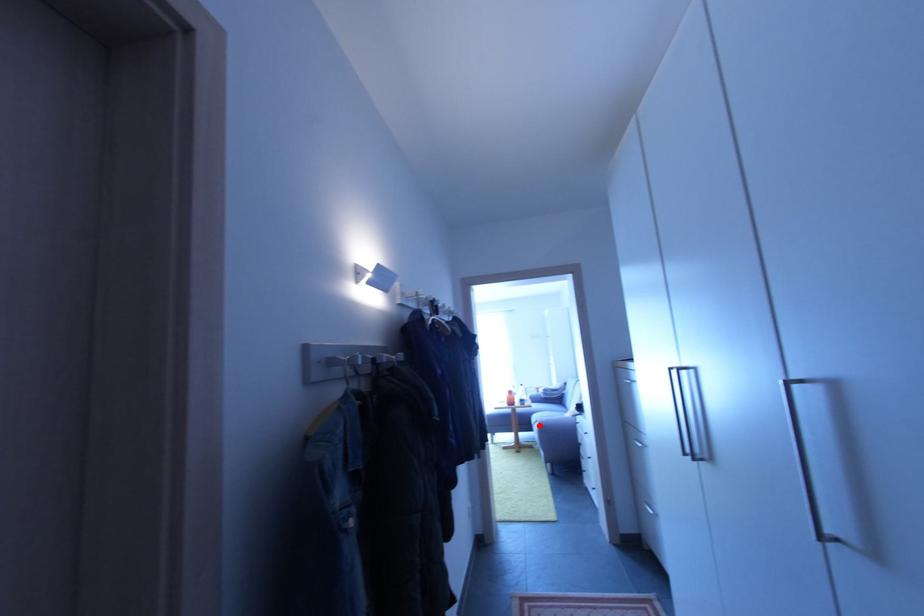
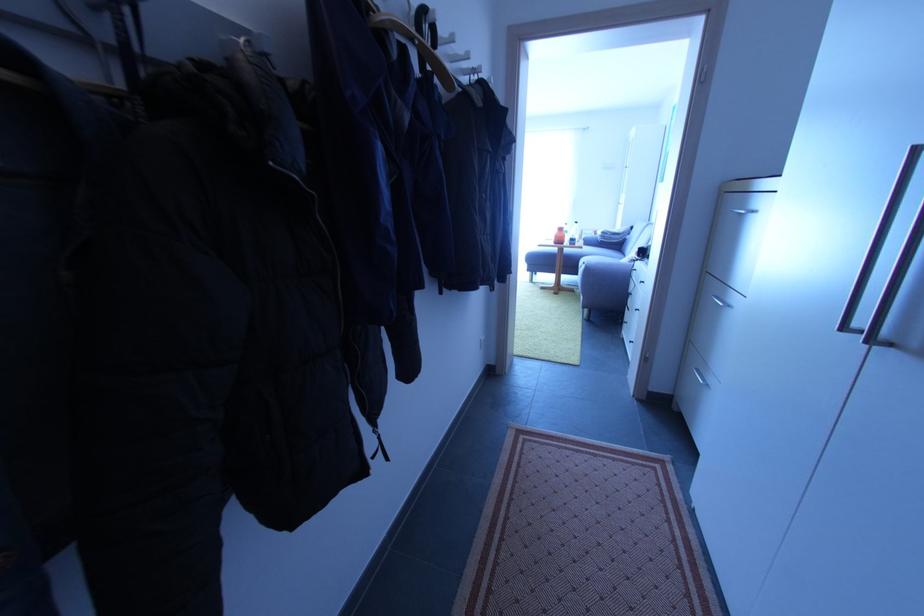
Find the pixel in the second image that matches the highlighted location in the first image.

(586, 268)